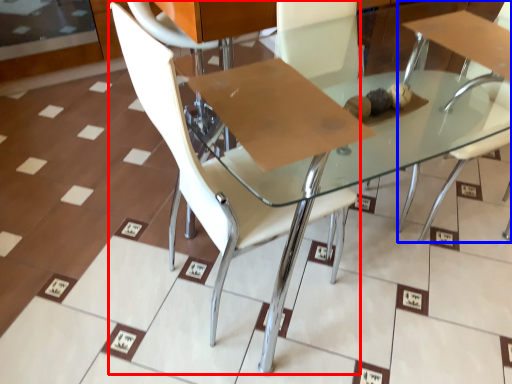
Question: Which object is closer to the camera taking this photo, chair (highlighted by a red box) or chair (highlighted by a blue box)?

Choices:
 (A) chair
 (B) chair

Answer: (A)